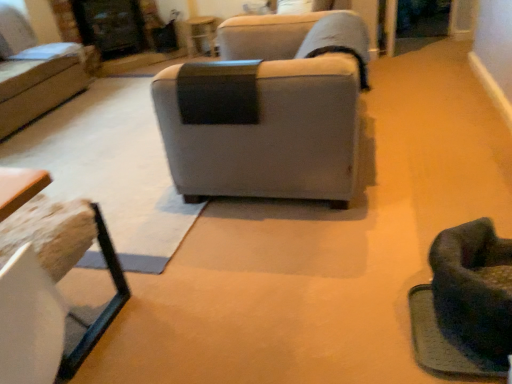
Describe the element at coordinates (472, 289) in the screenshot. The height and width of the screenshot is (384, 512). I see `soft green fabric swivel chair at lower right` at that location.

Describe the element at coordinates (37, 71) in the screenshot. The width and height of the screenshot is (512, 384). I see `matte gray couch at upper left, arranged as the 2th studio couch when ordered from the bottom` at that location.

Image resolution: width=512 pixels, height=384 pixels. What do you see at coordinates (268, 110) in the screenshot?
I see `gray fabric couch at center, acting as the second studio couch starting from the left` at bounding box center [268, 110].

You are a GUI agent. You are given a task and a screenshot of the screen. Output one action in this format:
    pyautogui.click(x=<x>, y=<y>)
    Task: Click on the gray fabric couch at center, the second studio couch from the back
    This screenshot has height=384, width=512.
    Given the screenshot: What is the action you would take?
    pyautogui.click(x=268, y=110)

Find the location of a particular element. matte black table at upper center, the first table in the top-to-bottom sequence is located at coordinates (201, 34).

Is matte gray couch at upper left, the first studio couch when ordered from left to right, next to matte black table at upper center, the second table from the bottom?

No, matte gray couch at upper left, the first studio couch when ordered from left to right, is not touching matte black table at upper center, the second table from the bottom.

Is matte gray couch at upper left, the first studio couch when ordered from left to right, not inside matte black table at upper center, which appears as the first table when viewed from the back?

Yes, matte gray couch at upper left, the first studio couch when ordered from left to right, is not within matte black table at upper center, which appears as the first table when viewed from the back.

Can you confirm if matte gray couch at upper left, the first studio couch when ordered from top to bottom, is thinner than matte black table at upper center, which appears as the first table when viewed from the back?

No, matte gray couch at upper left, the first studio couch when ordered from top to bottom, is not thinner than matte black table at upper center, which appears as the first table when viewed from the back.

Can you tell me how much matte gray couch at upper left, which appears as the first studio couch when viewed from the back, and matte black table at upper center, the second table from the bottom, differ in facing direction?

They differ by 89.4 degrees in their facing directions.

Does point (10, 350) lie in front of point (208, 34)?

Yes, point (10, 350) is closer to viewer.

Can you confirm if wooden textured table at lower left, which ranks as the 2th table in back-to-front order, is positioned to the right of matte black table at upper center, which is the second table from front to back?

No.

From the image's perspective, is wooden textured table at lower left, arranged as the 2th table when viewed from the top, positioned above or below matte black table at upper center, which is the second table from front to back?

From the image's perspective, wooden textured table at lower left, arranged as the 2th table when viewed from the top, appears below matte black table at upper center, which is the second table from front to back.

From a real-world perspective, does wooden textured table at lower left, arranged as the 2th table when viewed from the top, stand above matte black table at upper center, the first table in the top-to-bottom sequence?

Correct, in the physical world, wooden textured table at lower left, arranged as the 2th table when viewed from the top, is higher than matte black table at upper center, the first table in the top-to-bottom sequence.

Can you confirm if soft green fabric swivel chair at lower right is bigger than matte gray couch at upper left, placed as the 2th studio couch when sorted from front to back?

No, soft green fabric swivel chair at lower right is not bigger than matte gray couch at upper left, placed as the 2th studio couch when sorted from front to back.

Which object is further away from the camera, soft green fabric swivel chair at lower right or matte gray couch at upper left, the 2th studio couch from the right?

matte gray couch at upper left, the 2th studio couch from the right, is further away from the camera.

Is soft green fabric swivel chair at lower right facing towards matte gray couch at upper left, arranged as the 2th studio couch when ordered from the bottom?

No, soft green fabric swivel chair at lower right does not turn towards matte gray couch at upper left, arranged as the 2th studio couch when ordered from the bottom.

Looking at this image, is gray fabric couch at center, the 1th studio couch ordered from the bottom, positioned with its back to soft green fabric swivel chair at lower right?

gray fabric couch at center, the 1th studio couch ordered from the bottom, does not have its back to soft green fabric swivel chair at lower right.

Can you confirm if gray fabric couch at center, which is the first studio couch from right to left, is wider than soft green fabric swivel chair at lower right?

Correct, the width of gray fabric couch at center, which is the first studio couch from right to left, exceeds that of soft green fabric swivel chair at lower right.

Can we say gray fabric couch at center, which is the first studio couch from right to left, lies outside soft green fabric swivel chair at lower right?

Absolutely, gray fabric couch at center, which is the first studio couch from right to left, is external to soft green fabric swivel chair at lower right.

Between gray fabric couch at center, acting as the second studio couch starting from the left, and soft green fabric swivel chair at lower right, which one has less height?

Standing shorter between the two is soft green fabric swivel chair at lower right.

Which is in front, point (39, 185) or point (311, 104)?

The point (39, 185) is closer.

Is wooden textured table at lower left, which ranks as the first table in front-to-back order, closer to camera compared to gray fabric couch at center, the second studio couch from the back?

Yes, wooden textured table at lower left, which ranks as the first table in front-to-back order, is closer to the camera.

From the image's perspective, is wooden textured table at lower left, marked as the first table in a bottom-to-top arrangement, on top of gray fabric couch at center, arranged as the first studio couch when viewed from the front?

No, from the image's perspective, wooden textured table at lower left, marked as the first table in a bottom-to-top arrangement, is not on top of gray fabric couch at center, arranged as the first studio couch when viewed from the front.

In the scene shown: Are wooden textured table at lower left, which ranks as the first table in front-to-back order, and matte gray couch at upper left, placed as the 2th studio couch when sorted from front to back, located far from each other?

Absolutely, wooden textured table at lower left, which ranks as the first table in front-to-back order, is distant from matte gray couch at upper left, placed as the 2th studio couch when sorted from front to back.

Can you confirm if wooden textured table at lower left, marked as the first table in a bottom-to-top arrangement, is thinner than matte gray couch at upper left, the 2th studio couch from the right?

Indeed, wooden textured table at lower left, marked as the first table in a bottom-to-top arrangement, has a lesser width compared to matte gray couch at upper left, the 2th studio couch from the right.

Considering the relative positions of wooden textured table at lower left, which ranks as the first table in front-to-back order, and matte gray couch at upper left, the 2th studio couch from the right, in the image provided, is wooden textured table at lower left, which ranks as the first table in front-to-back order, to the right of matte gray couch at upper left, the 2th studio couch from the right, from the viewer's perspective?

Indeed, wooden textured table at lower left, which ranks as the first table in front-to-back order, is positioned on the right side of matte gray couch at upper left, the 2th studio couch from the right.

Who is taller, wooden textured table at lower left, arranged as the 2th table when viewed from the top, or matte gray couch at upper left, the first studio couch when ordered from top to bottom?

Standing taller between the two is matte gray couch at upper left, the first studio couch when ordered from top to bottom.

In order to click on swivel chair above the wooden textured table at lower left, which ranks as the first table in front-to-back order (from the image's perspective) in this screenshot , I will do `click(472, 289)`.

Considering the sizes of soft green fabric swivel chair at lower right and wooden textured table at lower left, arranged as the 2th table when viewed from the top, in the image, is soft green fabric swivel chair at lower right bigger or smaller than wooden textured table at lower left, arranged as the 2th table when viewed from the top,?

soft green fabric swivel chair at lower right is smaller than wooden textured table at lower left, arranged as the 2th table when viewed from the top.

Is point (490, 236) positioned in front of point (32, 380)?

No, it is not.

From a real-world perspective, who is located lower, soft green fabric swivel chair at lower right or wooden textured table at lower left, arranged as the 2th table when viewed from the top?

soft green fabric swivel chair at lower right, from a real-world perspective.

Where is `studio couch on the left of matte black table at upper center, which is the second table from front to back`? This screenshot has height=384, width=512. studio couch on the left of matte black table at upper center, which is the second table from front to back is located at coordinates (37, 71).

In the image, there is a wooden textured table at lower left, arranged as the 2th table when viewed from the top. At what (x,y) coordinates should I click in order to perform the action: click on table below it (from a real-world perspective). Please return your answer as a coordinate pair (x, y). Looking at the image, I should click on (201, 34).

From the image, which object appears to be farther from gray fabric couch at center, the second studio couch in the top-to-bottom sequence, wooden textured table at lower left, marked as the first table in a bottom-to-top arrangement, or matte gray couch at upper left, the first studio couch when ordered from top to bottom?

matte gray couch at upper left, the first studio couch when ordered from top to bottom.

Based on their spatial positions, is matte black table at upper center, the second table from the bottom, or soft green fabric swivel chair at lower right closer to gray fabric couch at center, the second studio couch from the back?

soft green fabric swivel chair at lower right.

Considering their positions, is matte gray couch at upper left, which appears as the first studio couch when viewed from the back, positioned closer to gray fabric couch at center, acting as the second studio couch starting from the left, than wooden textured table at lower left, which ranks as the first table in front-to-back order?

wooden textured table at lower left, which ranks as the first table in front-to-back order, is closer to gray fabric couch at center, acting as the second studio couch starting from the left.

Based on their spatial positions, is gray fabric couch at center, the second studio couch in the top-to-bottom sequence, or matte gray couch at upper left, the first studio couch when ordered from left to right, closer to wooden textured table at lower left, arranged as the 2th table when viewed from the top?

gray fabric couch at center, the second studio couch in the top-to-bottom sequence, is positioned closer to the anchor wooden textured table at lower left, arranged as the 2th table when viewed from the top.

Looking at the image, which one is located further to matte gray couch at upper left, which appears as the first studio couch when viewed from the back, matte black table at upper center, the second table from the bottom, or soft green fabric swivel chair at lower right?

Among the two, soft green fabric swivel chair at lower right is located further to matte gray couch at upper left, which appears as the first studio couch when viewed from the back.

Estimate the real-world distances between objects in this image. Which object is closer to matte gray couch at upper left, which appears as the first studio couch when viewed from the back, matte black table at upper center, the second table from the bottom, or gray fabric couch at center, the 1th studio couch ordered from the bottom?

matte black table at upper center, the second table from the bottom.

From the image, which object appears to be farther from matte black table at upper center, which appears as the first table when viewed from the back, wooden textured table at lower left, marked as the first table in a bottom-to-top arrangement, or gray fabric couch at center, the 1th studio couch ordered from the bottom?

wooden textured table at lower left, marked as the first table in a bottom-to-top arrangement, lies further to matte black table at upper center, which appears as the first table when viewed from the back, than the other object.

Looking at the image, which one is located further to soft green fabric swivel chair at lower right, wooden textured table at lower left, arranged as the 2th table when viewed from the top, or matte black table at upper center, the second table from the bottom?

matte black table at upper center, the second table from the bottom.

Where is `studio couch between gray fabric couch at center, which is the first studio couch from right to left, and matte black table at upper center, the first table in the top-to-bottom sequence, along the z-axis`? The height and width of the screenshot is (384, 512). studio couch between gray fabric couch at center, which is the first studio couch from right to left, and matte black table at upper center, the first table in the top-to-bottom sequence, along the z-axis is located at coordinates (37, 71).

Locate an element on the screen. studio couch located between wooden textured table at lower left, marked as the first table in a bottom-to-top arrangement, and matte gray couch at upper left, the first studio couch when ordered from top to bottom, in the depth direction is located at coordinates (268, 110).

The width and height of the screenshot is (512, 384). Find the location of `swivel chair located between wooden textured table at lower left, which ranks as the 2th table in back-to-front order, and matte black table at upper center, the second table from the bottom, in the depth direction`. swivel chair located between wooden textured table at lower left, which ranks as the 2th table in back-to-front order, and matte black table at upper center, the second table from the bottom, in the depth direction is located at coordinates (472, 289).

Find the location of a particular element. This screenshot has width=512, height=384. studio couch between wooden textured table at lower left, which ranks as the 2th table in back-to-front order, and soft green fabric swivel chair at lower right from left to right is located at coordinates (268, 110).